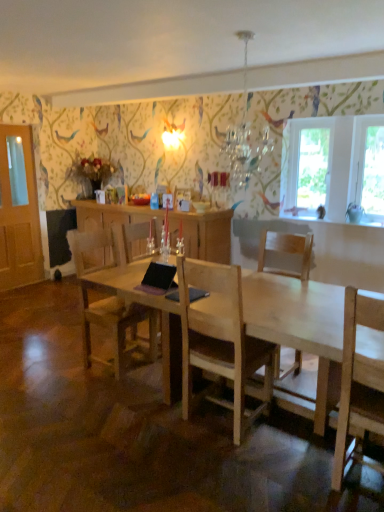
I want to click on free point above transparent glass window at upper right, marked as the first window screen in a left-to-right arrangement (from a real-world perspective), so click(316, 121).